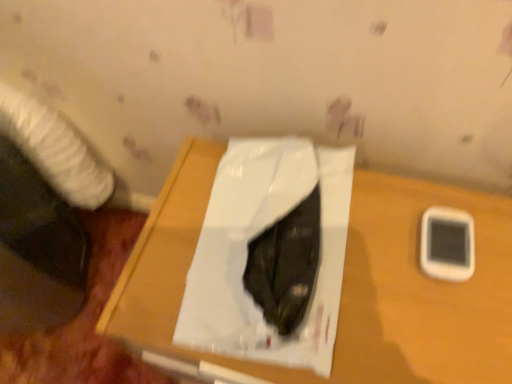
This screenshot has height=384, width=512. I want to click on vacant area located to the right-hand side of white plastic mobile phone at right, so click(489, 236).